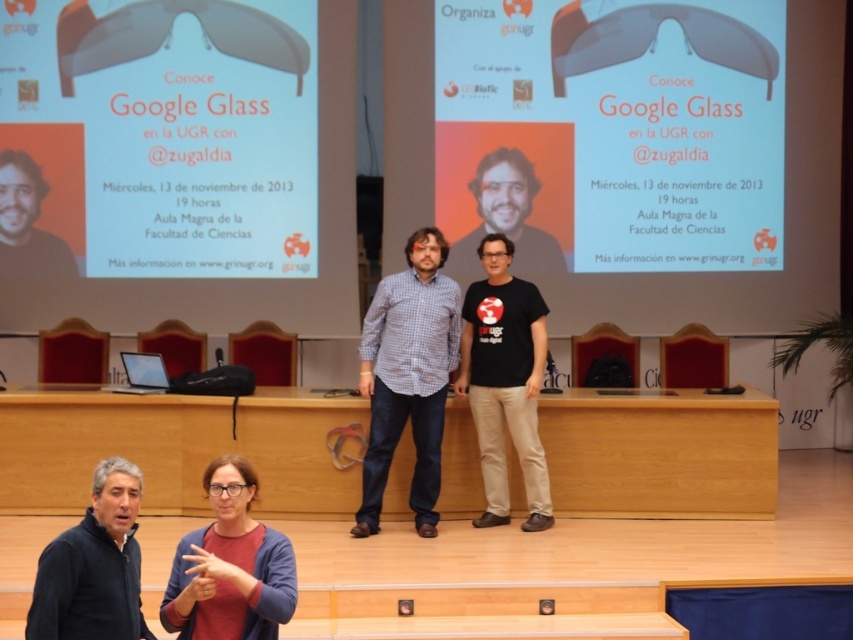
Is matte white google glass at upper center shorter than matte blue sweater at lower center?

No.

Is matte white google glass at upper center to the right of matte blue sweater at lower center from the viewer's perspective?

Incorrect, matte white google glass at upper center is not on the right side of matte blue sweater at lower center.

Is point (335, 140) positioned after point (196, 580)?

Yes.

The width and height of the screenshot is (853, 640). What are the coordinates of `matte white google glass at upper center` in the screenshot? It's located at (238, 278).

Is point (404, 294) in front of point (38, 248)?

Yes, it is in front of point (38, 248).

Is checkered fabric shirt at center above matte black face at left?

Incorrect, checkered fabric shirt at center is not positioned above matte black face at left.

The width and height of the screenshot is (853, 640). I want to click on checkered fabric shirt at center, so click(408, 376).

What are the coordinates of `matte white google glass at upper center` in the screenshot? It's located at (238, 278).

Between matte white google glass at upper center and matte black face at left, which one is positioned lower?

Positioned lower is matte white google glass at upper center.

The height and width of the screenshot is (640, 853). What do you see at coordinates (238, 278) in the screenshot?
I see `matte white google glass at upper center` at bounding box center [238, 278].

Where is `matte white google glass at upper center`? This screenshot has height=640, width=853. matte white google glass at upper center is located at coordinates (238, 278).